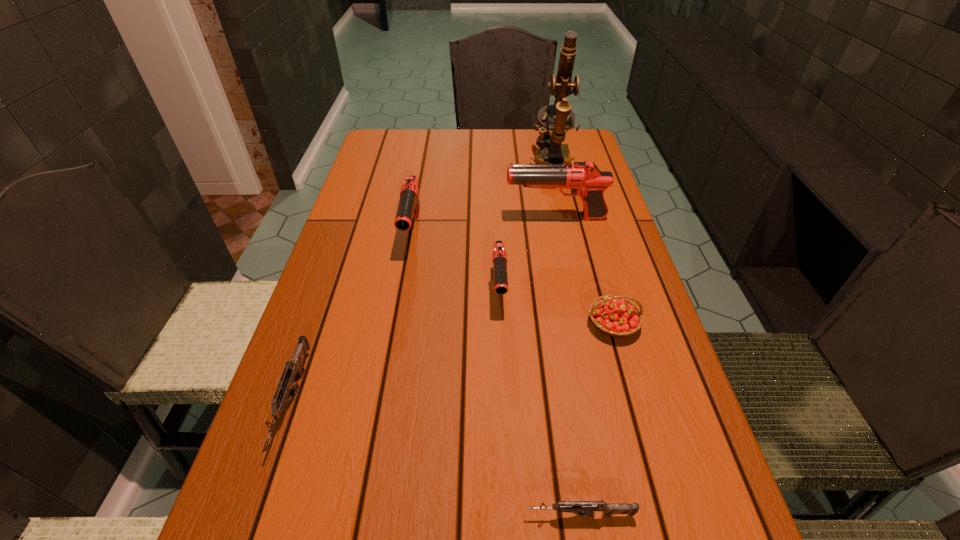
You are a GUI agent. You are given a task and a screenshot of the screen. Output one action in this format:
    pyautogui.click(x=<x>, y=<y>)
    Task: Click on the vacant space situated on the left of the brown strawberry
    
    Given the screenshot: What is the action you would take?
    pyautogui.click(x=539, y=324)

Image resolution: width=960 pixels, height=540 pixels. Find the location of `free spot located aimed along the barrel of the farther grey gun`. free spot located aimed along the barrel of the farther grey gun is located at coordinates (257, 505).

The image size is (960, 540). Find the location of `free spot located aimed along the barrel of the nearest object`. free spot located aimed along the barrel of the nearest object is located at coordinates (390, 515).

Where is `vacant region located 0.380m aimed along the barrel of the nearest object`? This screenshot has height=540, width=960. vacant region located 0.380m aimed along the barrel of the nearest object is located at coordinates 269,515.

Where is `blank area located 0.400m aimed along the barrel of the nearest object`? The width and height of the screenshot is (960, 540). blank area located 0.400m aimed along the barrel of the nearest object is located at coordinates tap(255, 515).

Where is `object located at the far edge`? object located at the far edge is located at coordinates 553,130.

Where is `object located in the left edge section of the desktop`? This screenshot has width=960, height=540. object located in the left edge section of the desktop is located at coordinates (295, 366).

Identify the location of microscope positioned at the right edge. (553, 130).

Where is `strawberry that is at the right edge`? This screenshot has height=540, width=960. strawberry that is at the right edge is located at coordinates (616, 316).

Locate an element on the screen. object located in the far right corner section of the desktop is located at coordinates (553, 130).